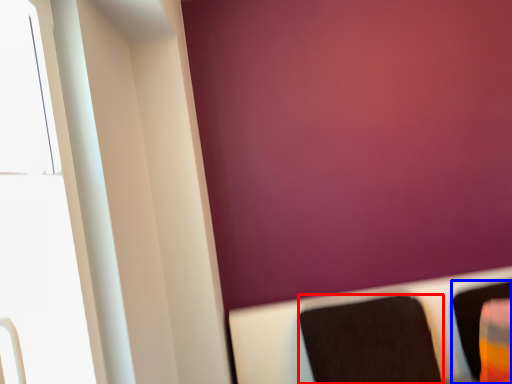
Question: Among these objects, which one is nearest to the camera, furniture (highlighted by a red box) or furniture (highlighted by a blue box)?

Choices:
 (A) furniture
 (B) furniture

Answer: (A)